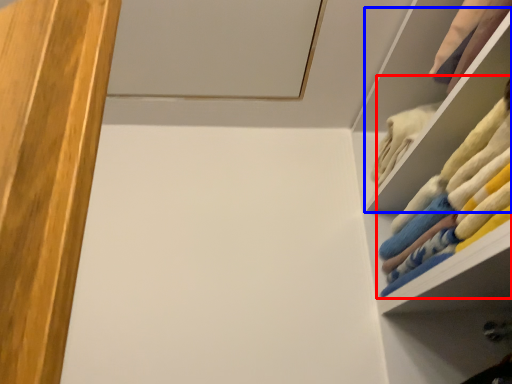
Question: Which object is closer to the camera taking this photo, laundry (highlighted by a red box) or cabinet (highlighted by a blue box)?

Choices:
 (A) laundry
 (B) cabinet

Answer: (A)